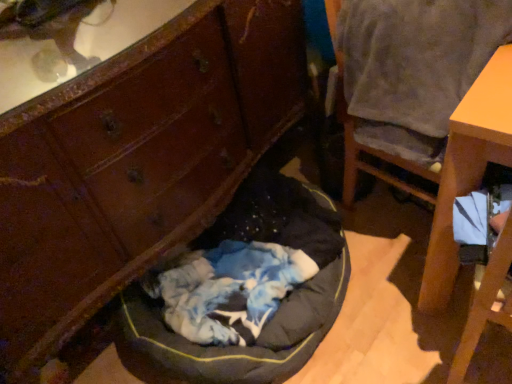
Question: Is dark gray fabric dog bed at center outside of gray fabric chair at upper right?

Choices:
 (A) yes
 (B) no

Answer: (A)

Question: Can you confirm if dark gray fabric dog bed at center is shorter than gray fabric chair at upper right?

Choices:
 (A) yes
 (B) no

Answer: (A)

Question: Considering the relative sizes of dark gray fabric dog bed at center and gray fabric chair at upper right in the image provided, is dark gray fabric dog bed at center smaller than gray fabric chair at upper right?

Choices:
 (A) yes
 (B) no

Answer: (B)

Question: Is dark gray fabric dog bed at center closer to the viewer compared to gray fabric chair at upper right?

Choices:
 (A) yes
 (B) no

Answer: (B)

Question: Is dark gray fabric dog bed at center aimed at gray fabric chair at upper right?

Choices:
 (A) no
 (B) yes

Answer: (A)

Question: From the image's perspective, is dark gray fabric dog bed at center above gray fabric chair at upper right?

Choices:
 (A) yes
 (B) no

Answer: (B)

Question: Does gray fabric chair at upper right have a smaller size compared to wooden dresser at lower left?

Choices:
 (A) no
 (B) yes

Answer: (B)

Question: Is the position of gray fabric chair at upper right more distant than that of wooden dresser at lower left?

Choices:
 (A) no
 (B) yes

Answer: (B)

Question: Does gray fabric chair at upper right have a greater width compared to wooden dresser at lower left?

Choices:
 (A) yes
 (B) no

Answer: (B)

Question: From a real-world perspective, is gray fabric chair at upper right over wooden dresser at lower left?

Choices:
 (A) yes
 (B) no

Answer: (B)

Question: Does gray fabric chair at upper right have a larger size compared to wooden dresser at lower left?

Choices:
 (A) yes
 (B) no

Answer: (B)

Question: Can we say gray fabric chair at upper right lies outside wooden dresser at lower left?

Choices:
 (A) yes
 (B) no

Answer: (A)

Question: From the image's perspective, is dark gray fabric dog bed at center located above wooden dresser at lower left?

Choices:
 (A) yes
 (B) no

Answer: (B)